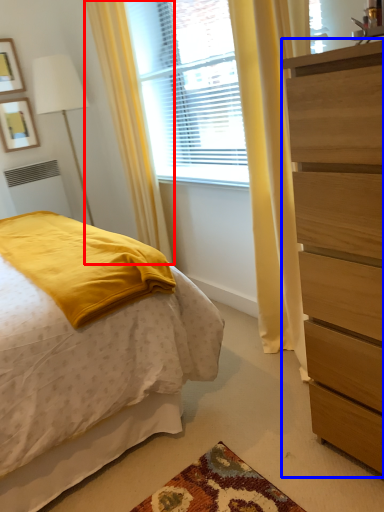
Question: Which object is closer to the camera taking this photo, curtain (highlighted by a red box) or chest of drawers (highlighted by a blue box)?

Choices:
 (A) curtain
 (B) chest of drawers

Answer: (B)